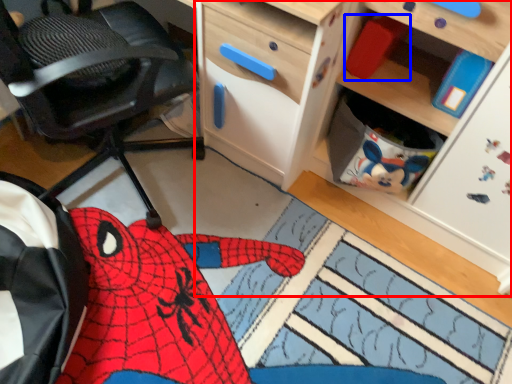
Question: Which object appears farthest to the camera in this image, cabinetry (highlighted by a red box) or toy (highlighted by a blue box)?

Choices:
 (A) cabinetry
 (B) toy

Answer: (B)